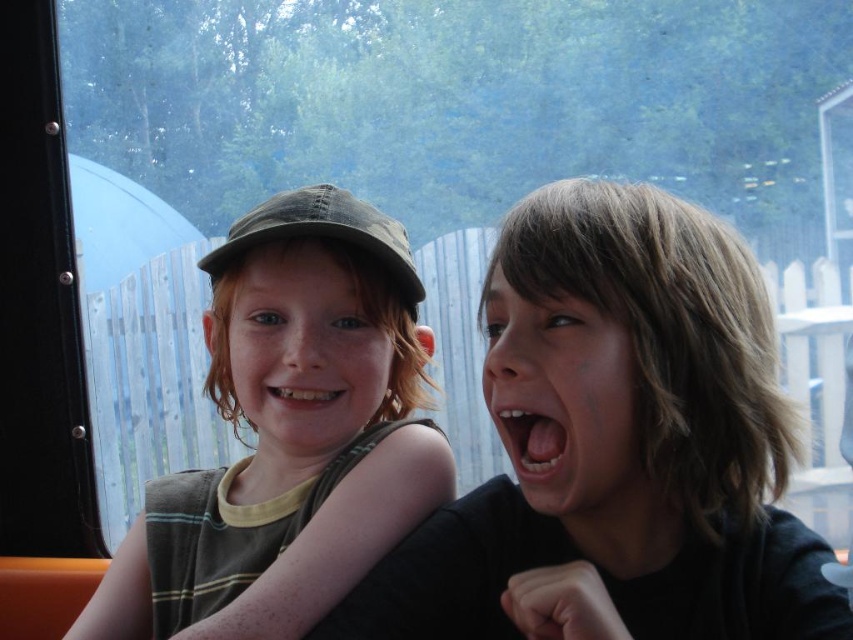
Which is in front, point (503, 408) or point (335, 401)?

Point (503, 408)

Is smooth white teeth at center closer to the viewer compared to white glossy teeth at center?

Yes, it is in front of white glossy teeth at center.

Where is `smooth white teeth at center`? The height and width of the screenshot is (640, 853). smooth white teeth at center is located at coordinates (529, 436).

Is smooth skin face at center below smooth white teeth at center?

Actually, smooth skin face at center is above smooth white teeth at center.

Is smooth skin face at center in front of smooth white teeth at center?

Yes, it is.

Image resolution: width=853 pixels, height=640 pixels. Identify the location of smooth skin face at center. (563, 403).

Between point (160, 497) and point (320, 244), which one is positioned in front?

Point (320, 244)

Based on the photo, between matte green cap at left and matte black cap at upper left, which one is positioned lower?

matte green cap at left is below.

Who is more distant from viewer, (225,554) or (344,412)?

Point (225,554)

This screenshot has width=853, height=640. I want to click on matte green cap at left, so click(x=297, y=422).